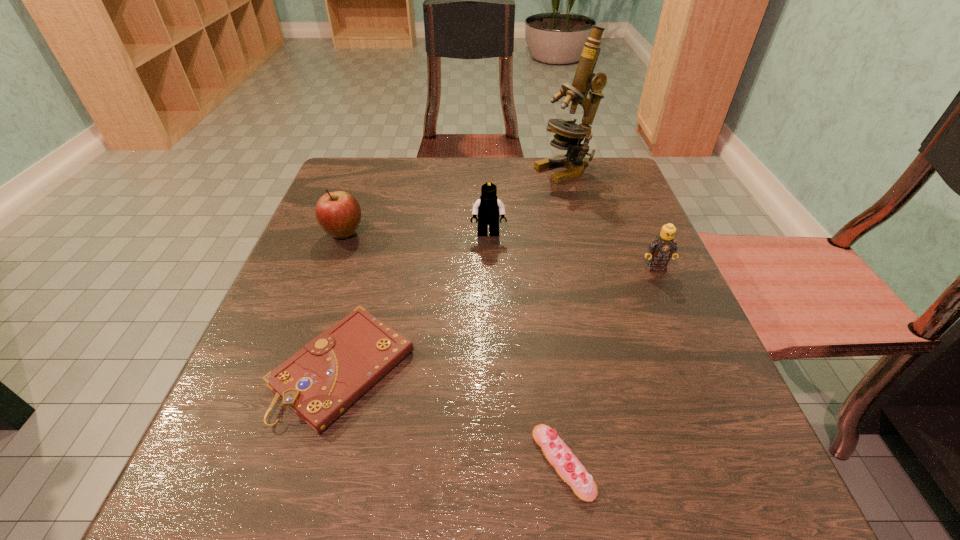
Find the location of `the third closest object to the apple`. the third closest object to the apple is located at coordinates (569, 135).